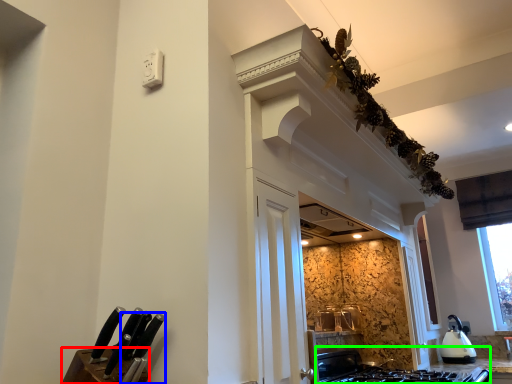
Question: Considering the real-world distances, which object is farthest from cabinetry (highlighted by a red box)? knife (highlighted by a blue box) or gas stove (highlighted by a green box)?

Choices:
 (A) knife
 (B) gas stove

Answer: (B)